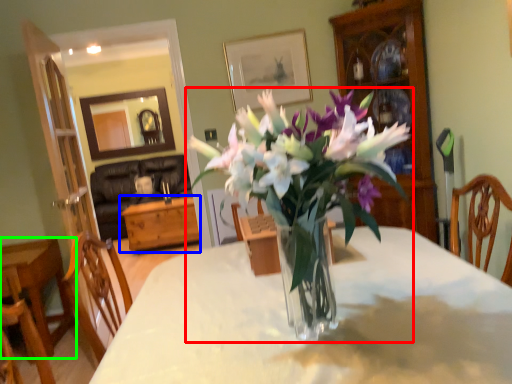
Question: Estimate the real-world distances between objects in this image. Which object is closer to houseplant (highlighted by a red box), table (highlighted by a blue box) or table (highlighted by a green box)?

Choices:
 (A) table
 (B) table

Answer: (B)